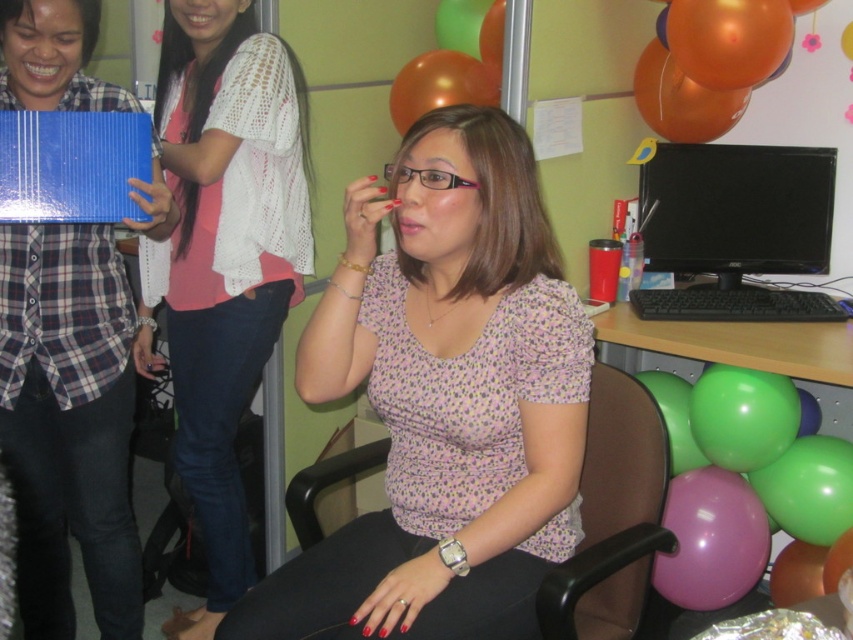
Which is above, pink floral blouse at center or black glossy monitor at center?

black glossy monitor at center is higher up.

Between point (407, 228) and point (805, 292), which one is positioned behind?

The point (805, 292) is behind.

Identify the location of pink floral blouse at center. (444, 397).

Which is in front, point (218, 490) or point (654, 424)?

Point (654, 424) is more forward.

Who is taller, pink crochet cardigan at upper left or black plastic swivel chair at center?

Standing taller between the two is pink crochet cardigan at upper left.

Is point (187, 323) less distant than point (585, 497)?

No, (187, 323) is further to viewer.

Find the location of a particular element. The width and height of the screenshot is (853, 640). pink crochet cardigan at upper left is located at coordinates (224, 256).

Is the position of black glossy monitor at center less distant than that of purple glossy balloon at lower right?

Yes, black glossy monitor at center is in front of purple glossy balloon at lower right.

Which is more to the left, black glossy monitor at center or purple glossy balloon at lower right?

From the viewer's perspective, purple glossy balloon at lower right appears more on the left side.

Is point (816, 314) positioned behind point (753, 497)?

That is False.

Find the location of a particular element. black glossy monitor at center is located at coordinates (735, 228).